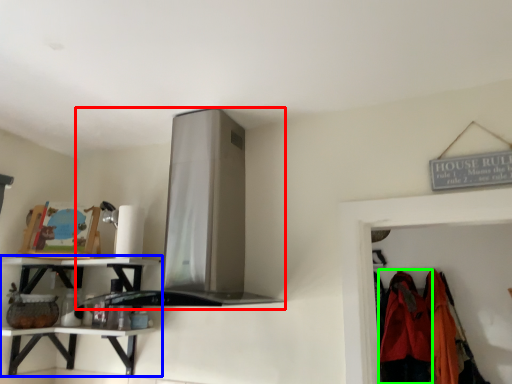
Question: Estimate the real-world distances between objects in this image. Which object is farther from exhaust hood (highlighted by a red box), shelf (highlighted by a blue box) or clothing (highlighted by a green box)?

Choices:
 (A) shelf
 (B) clothing

Answer: (B)